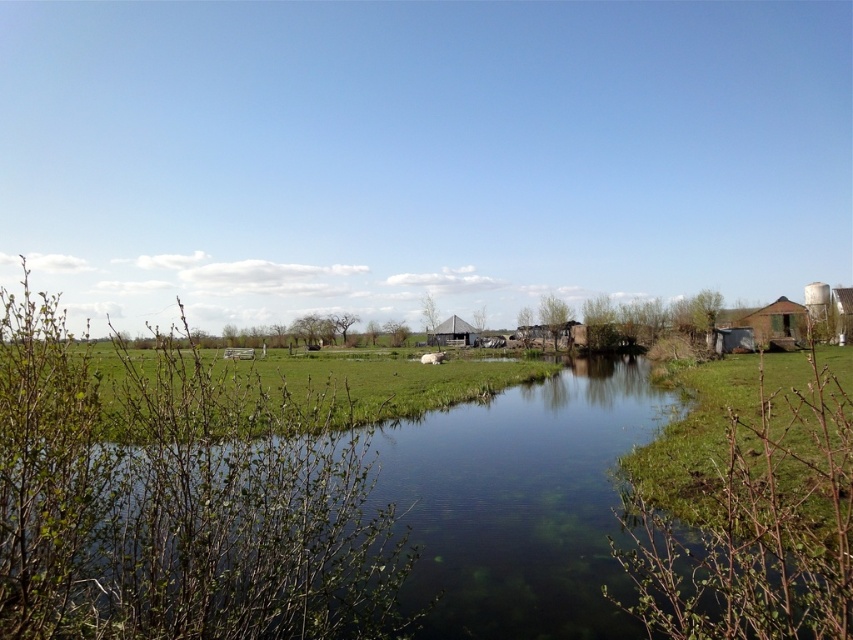
You are a farmer checking the condition of your fields. You notice two patches of green grass at center and green grass at lower right. If your tractor has a turning radius of 60 feet, can you turn the tractor between these two grass patches without hitting either?

The distance between the green grass at center and green grass at lower right is 71.58 feet. Since the tractor requires a turning radius of 60 feet, the tractor can turn between them as the distance is greater than the required turning radius.

You are standing at the edge of the water and want to walk to the brown wooden hut at right. Which direction should you head to first? The green grass at lower right is in your way. Do you need to step on it?

The green grass at lower right is positioned on the left side of brown wooden hut at right. To reach the brown wooden hut at right, you should head towards the right direction. Since the green grass at lower right is on the left side of the hut, you can avoid stepping on it by moving around to the right side of the grass.